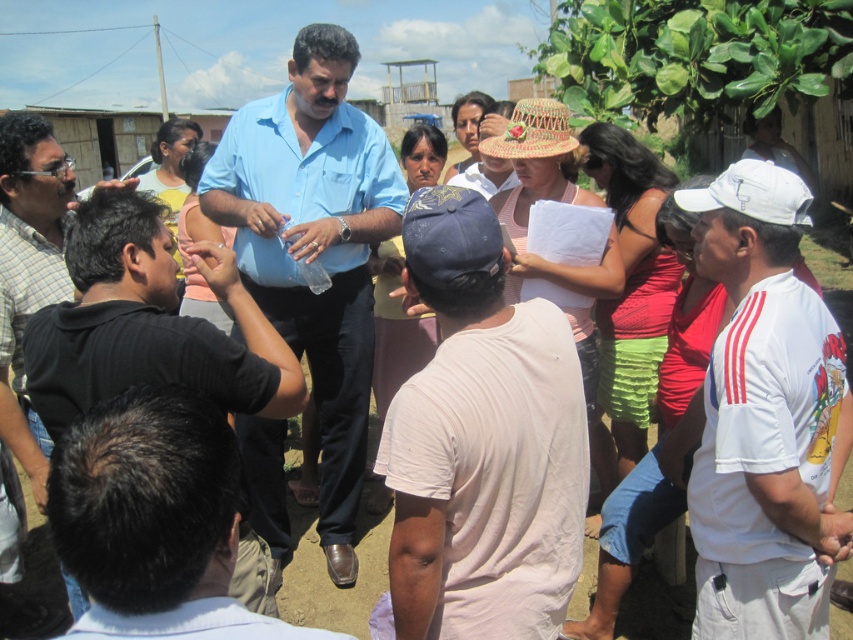
Question: Which object is positioned farthest from the black cotton shirt at left?

Choices:
 (A) white fabric shirt at right
 (B) white cotton t-shirt at center
 (C) brown woven straw hat at center

Answer: (C)

Question: Is white fabric shirt at right thinner than matte blue shirt at center?

Choices:
 (A) yes
 (B) no

Answer: (A)

Question: Does white cotton t-shirt at center have a greater width compared to white fabric shirt at right?

Choices:
 (A) no
 (B) yes

Answer: (B)

Question: Which point appears closest to the camera in this image?

Choices:
 (A) (550, 156)
 (B) (213, 506)

Answer: (B)

Question: Which of these objects is positioned closest to the white cotton t-shirt at center?

Choices:
 (A) matte blue shirt at center
 (B) braided straw hat at center
 (C) black cotton shirt at left
 (D) white fabric shirt at right

Answer: (C)

Question: Does white cotton t-shirt at center appear on the right side of light blue shirt at center?

Choices:
 (A) no
 (B) yes

Answer: (B)